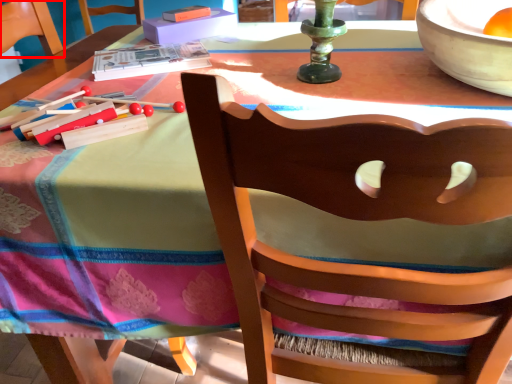
Question: Considering the relative positions of armchair (annotated by the red box) and chair in the image provided, where is armchair (annotated by the red box) located with respect to the staircase?

Choices:
 (A) left
 (B) right

Answer: (A)